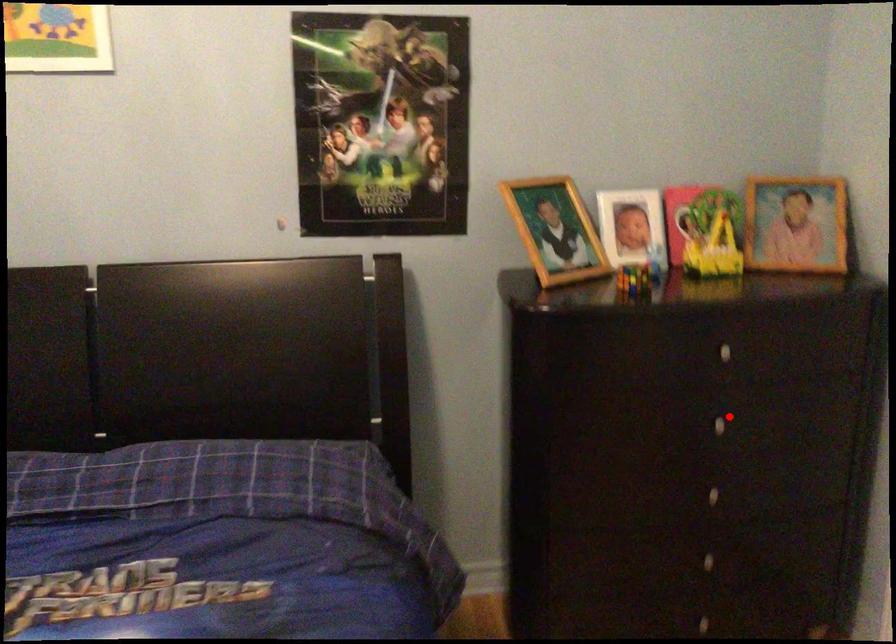
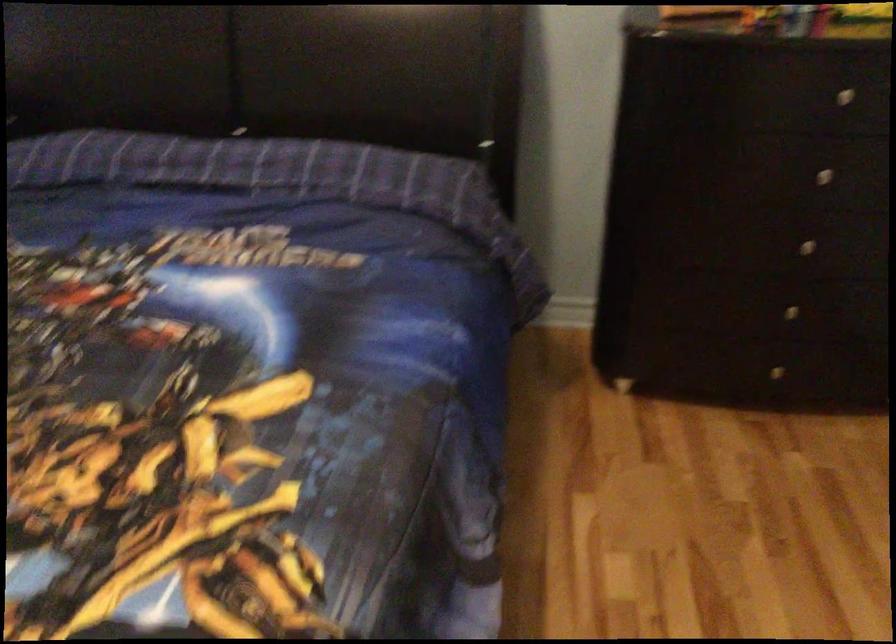
Locate, in the second image, the point that corresponds to the highlighted location in the first image.

(833, 169)